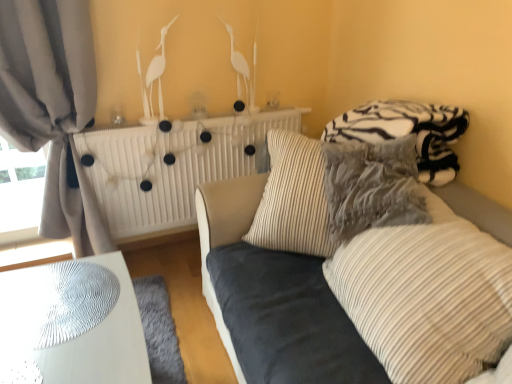
Question: Is striped fabric pillow at center, acting as the 1th pillow starting from the front, directly adjacent to striped fabric pillow at center, arranged as the second pillow when viewed from the front?

Choices:
 (A) no
 (B) yes

Answer: (A)

Question: From the image's perspective, is striped fabric pillow at center, acting as the 1th pillow starting from the front, beneath striped fabric pillow at center, which is counted as the 1th pillow, starting from the back?

Choices:
 (A) yes
 (B) no

Answer: (A)

Question: From a real-world perspective, is striped fabric pillow at center, which ranks as the 2th pillow in back-to-front order, physically above striped fabric pillow at center, which is counted as the 1th pillow, starting from the back?

Choices:
 (A) yes
 (B) no

Answer: (B)

Question: Considering the relative sizes of striped fabric pillow at center, which ranks as the 2th pillow in back-to-front order, and striped fabric pillow at center, arranged as the second pillow when viewed from the front, in the image provided, is striped fabric pillow at center, which ranks as the 2th pillow in back-to-front order, taller than striped fabric pillow at center, arranged as the second pillow when viewed from the front,?

Choices:
 (A) no
 (B) yes

Answer: (B)

Question: Is striped fabric pillow at center, acting as the 1th pillow starting from the front, oriented towards striped fabric pillow at center, which is counted as the 1th pillow, starting from the back?

Choices:
 (A) yes
 (B) no

Answer: (B)

Question: Do you think zebra-patterned fleece blanket at upper right is within white glossy table at lower left, or outside of it?

Choices:
 (A) inside
 (B) outside

Answer: (B)

Question: From the image's perspective, is zebra-patterned fleece blanket at upper right above or below white glossy table at lower left?

Choices:
 (A) above
 (B) below

Answer: (A)

Question: Considering their positions, is zebra-patterned fleece blanket at upper right located in front of or behind white glossy table at lower left?

Choices:
 (A) behind
 (B) front

Answer: (A)

Question: Is zebra-patterned fleece blanket at upper right wider or thinner than white glossy table at lower left?

Choices:
 (A) thin
 (B) wide

Answer: (A)

Question: Relative to striped fabric pillow at center, which is counted as the 1th pillow, starting from the back, is striped fabric pillow at center, which ranks as the 2th pillow in back-to-front order, in front or behind?

Choices:
 (A) behind
 (B) front

Answer: (B)

Question: In terms of height, does striped fabric pillow at center, which ranks as the 2th pillow in back-to-front order, look taller or shorter compared to striped fabric pillow at center, arranged as the second pillow when viewed from the front?

Choices:
 (A) tall
 (B) short

Answer: (A)

Question: Is point (330, 264) closer or farther from the camera than point (309, 203)?

Choices:
 (A) closer
 (B) farther

Answer: (A)

Question: In terms of width, does striped fabric pillow at center, acting as the 1th pillow starting from the front, look wider or thinner when compared to striped fabric pillow at center, arranged as the second pillow when viewed from the front?

Choices:
 (A) thin
 (B) wide

Answer: (A)

Question: Is striped fabric pillow at center, arranged as the second pillow when viewed from the front, taller or shorter than striped fabric pillow at center, acting as the 1th pillow starting from the front?

Choices:
 (A) short
 (B) tall

Answer: (A)

Question: Would you say striped fabric pillow at center, which is counted as the 1th pillow, starting from the back, is to the left or to the right of striped fabric pillow at center, which ranks as the 2th pillow in back-to-front order, in the picture?

Choices:
 (A) left
 (B) right

Answer: (A)